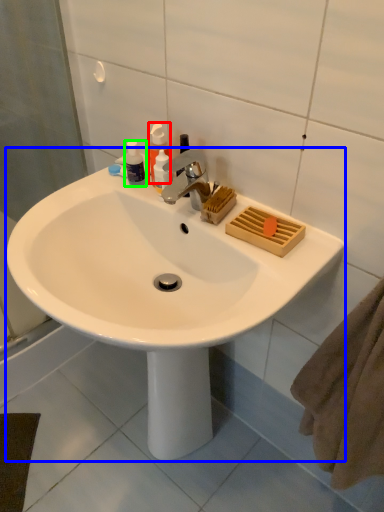
Question: Based on their relative distances, which object is nearer to soap dispenser (highlighted by a red box)? Choose from sink (highlighted by a blue box) and toiletry (highlighted by a green box).

Choices:
 (A) sink
 (B) toiletry

Answer: (B)